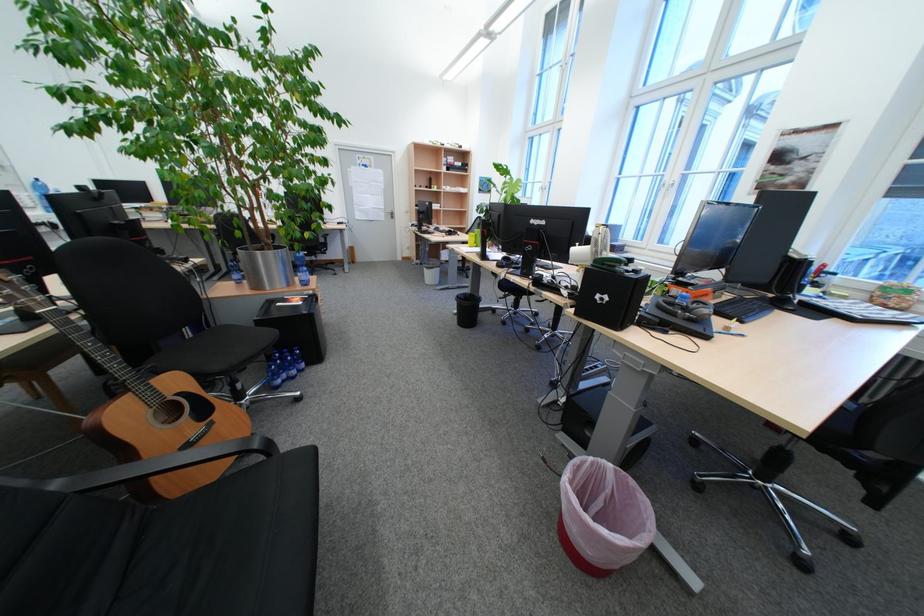
Identify the location of red trash can. The image size is (924, 616). (602, 516).